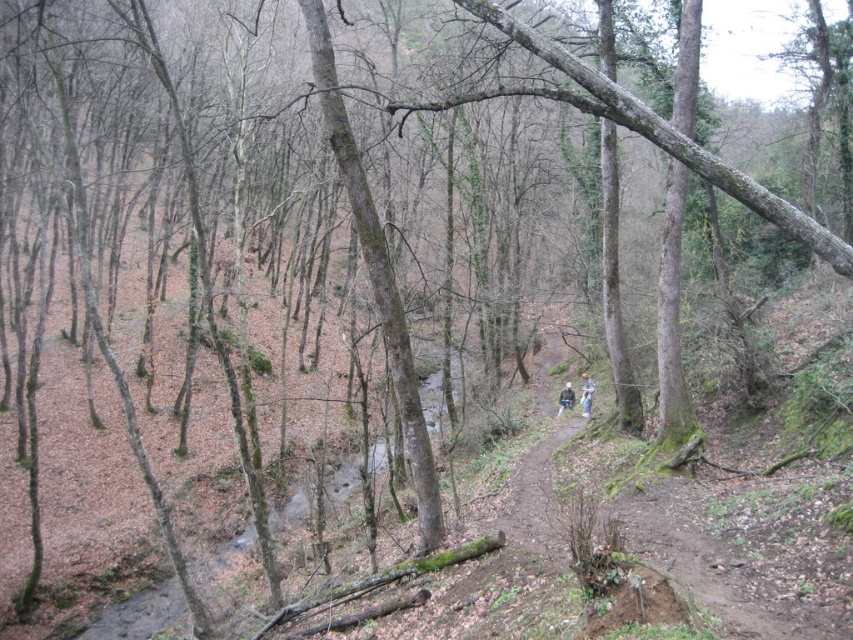
Question: Which object is closer to the camera taking this photo?

Choices:
 (A) blue denim jeans at center
 (B) blue fabric pants at center

Answer: (A)

Question: Considering the relative positions of blue denim jeans at center and blue fabric pants at center in the image provided, where is blue denim jeans at center located with respect to blue fabric pants at center?

Choices:
 (A) right
 (B) left

Answer: (A)

Question: Which point is farther to the camera?

Choices:
 (A) (590, 401)
 (B) (561, 397)

Answer: (B)

Question: Does blue denim jeans at center appear on the left side of blue fabric pants at center?

Choices:
 (A) no
 (B) yes

Answer: (A)

Question: Observing the image, what is the correct spatial positioning of blue denim jeans at center in reference to blue fabric pants at center?

Choices:
 (A) above
 (B) below

Answer: (A)